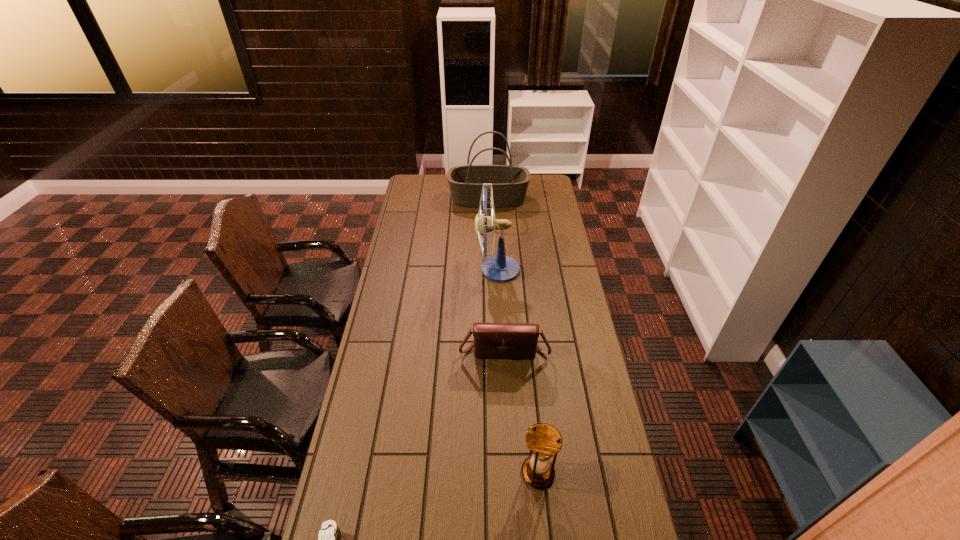
The width and height of the screenshot is (960, 540). What are the coordinates of `the tallest object` in the screenshot? It's located at (500, 268).

Locate an element on the screen. fan is located at coordinates (500, 268).

Locate an element on the screen. The image size is (960, 540). the fourth shortest object is located at coordinates (509, 183).

You are a GUI agent. You are given a task and a screenshot of the screen. Output one action in this format:
    pyautogui.click(x=<x>, y=<y>)
    Task: Click on the basket
    
    Given the screenshot: What is the action you would take?
    pyautogui.click(x=509, y=183)

Identify the location of hourglass. The height and width of the screenshot is (540, 960). (544, 441).

Image resolution: width=960 pixels, height=540 pixels. Find the location of `the third tallest object`. the third tallest object is located at coordinates (544, 441).

Where is `the second shortest object`? the second shortest object is located at coordinates (491, 340).

The width and height of the screenshot is (960, 540). I want to click on shoulder bag, so click(491, 340).

This screenshot has width=960, height=540. I want to click on vacant space located 0.180m at the front of the fan where the blades are visible, so click(x=437, y=269).

Locate an element on the screen. The height and width of the screenshot is (540, 960). vacant space located at the front of the fan where the blades are visible is located at coordinates (433, 269).